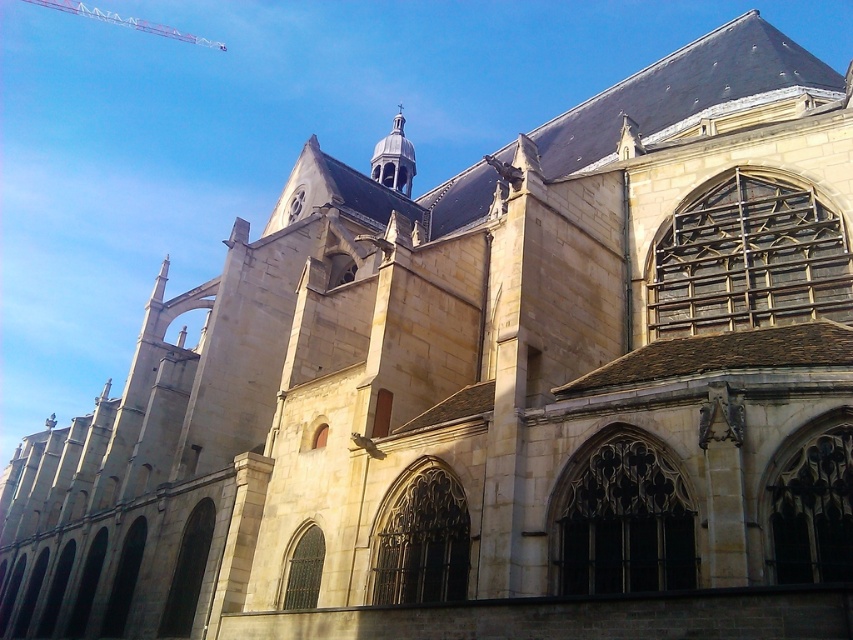
Does smooth gray spire at upper center have a smaller size compared to metallic red crane at upper left?

No, smooth gray spire at upper center is not smaller than metallic red crane at upper left.

Looking at this image, between smooth gray spire at upper center and metallic red crane at upper left, which one appears on the right side from the viewer's perspective?

Positioned to the right is smooth gray spire at upper center.

Does point (399, 168) come in front of point (55, 0)?

Yes.

Find the location of a particular element. This screenshot has height=640, width=853. smooth gray spire at upper center is located at coordinates (393, 157).